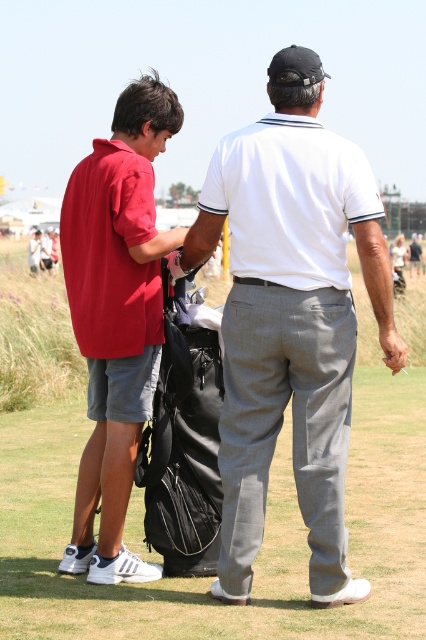
Can you confirm if matte black golf bag at center is wider than matte red polo shirt at left?

Yes.

Is point (350, 614) farther from viewer compared to point (134, 125)?

No, (350, 614) is closer to viewer.

Find the location of a particular element. Image resolution: width=426 pixels, height=640 pixels. matte black golf bag at center is located at coordinates (264, 525).

Which of these two, white cotton polo shirt at center or matte red polo shirt at left, stands shorter?

With less height is white cotton polo shirt at center.

Is white cotton polo shirt at center smaller than matte red polo shirt at left?

Yes, white cotton polo shirt at center is smaller than matte red polo shirt at left.

The width and height of the screenshot is (426, 640). What do you see at coordinates (290, 317) in the screenshot? I see `white cotton polo shirt at center` at bounding box center [290, 317].

The image size is (426, 640). In order to click on white cotton polo shirt at center in this screenshot , I will do `click(290, 317)`.

Is point (357, 572) positioned in front of point (184, 522)?

No, it is not.

Is point (71, 429) farther from viewer compared to point (166, 344)?

Yes, it is.

Locate an element on the screen. The height and width of the screenshot is (640, 426). matte black golf bag at center is located at coordinates (264, 525).